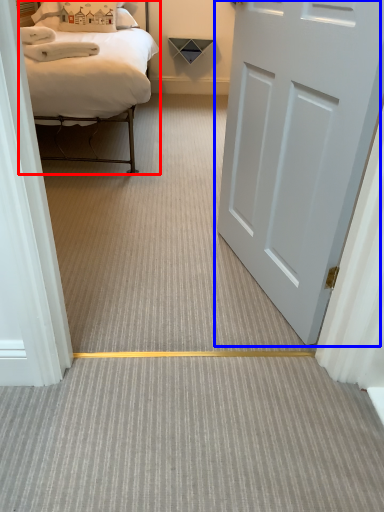
Question: Which object is closer to the camera taking this photo, bed (highlighted by a red box) or door (highlighted by a blue box)?

Choices:
 (A) bed
 (B) door

Answer: (B)